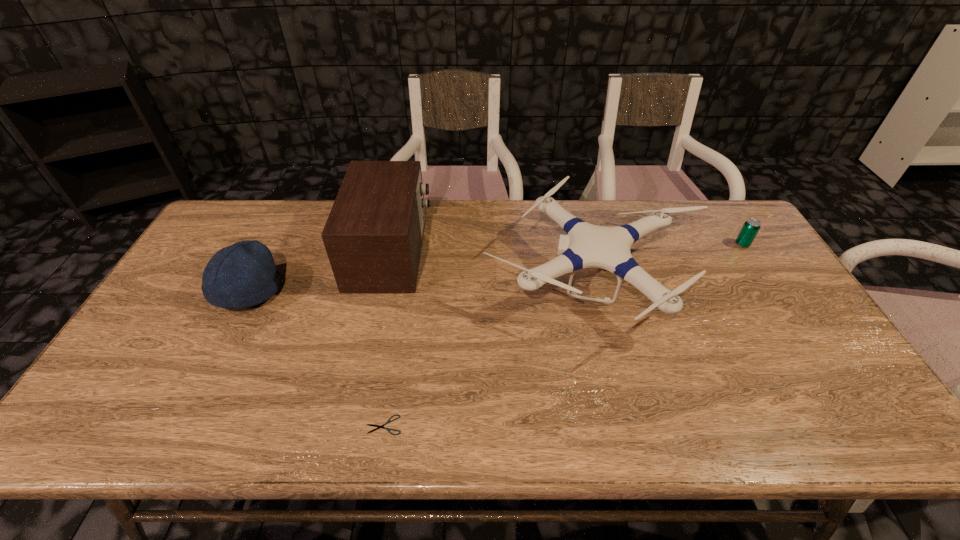
Where is `free spot that satisfies the following two spatial constraints: 1. on the front-facing side of the tallest object; 2. on the left side of the shears`? free spot that satisfies the following two spatial constraints: 1. on the front-facing side of the tallest object; 2. on the left side of the shears is located at coordinates (353, 425).

The height and width of the screenshot is (540, 960). In order to click on free space that satisfies the following two spatial constraints: 1. on the back side of the nearest object; 2. on the right side of the drone in this screenshot , I will do `click(408, 280)`.